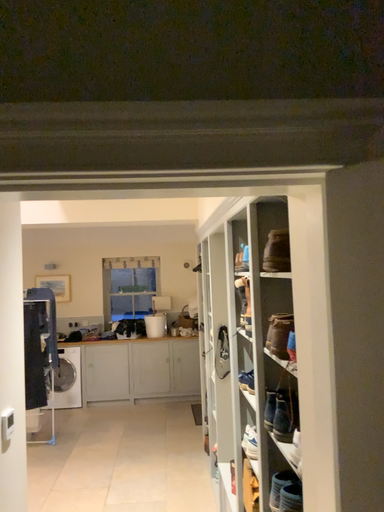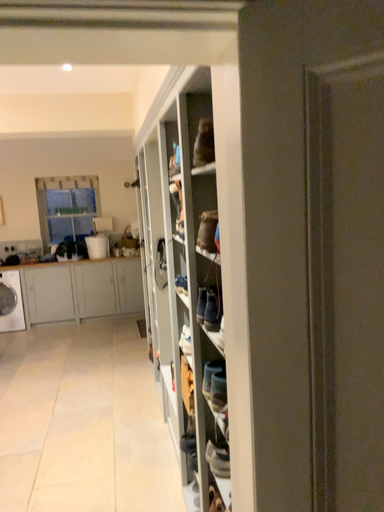
Question: Which way did the camera rotate in the video?

Choices:
 (A) rotated upward
 (B) rotated downward

Answer: (B)